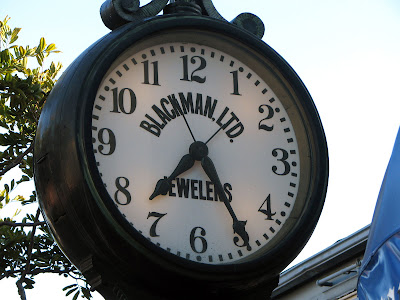
What are the coordinates of `clock` in the screenshot? It's located at (200, 143).